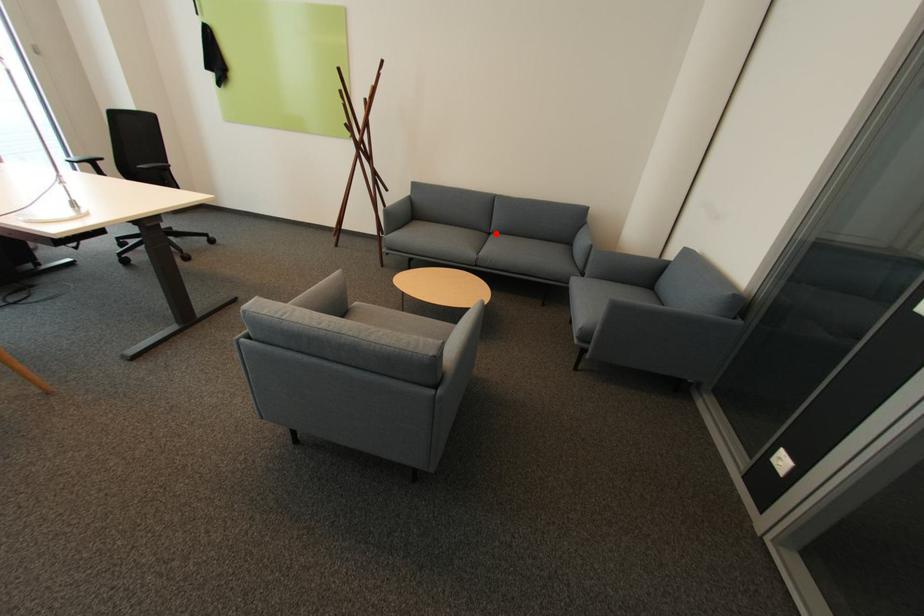
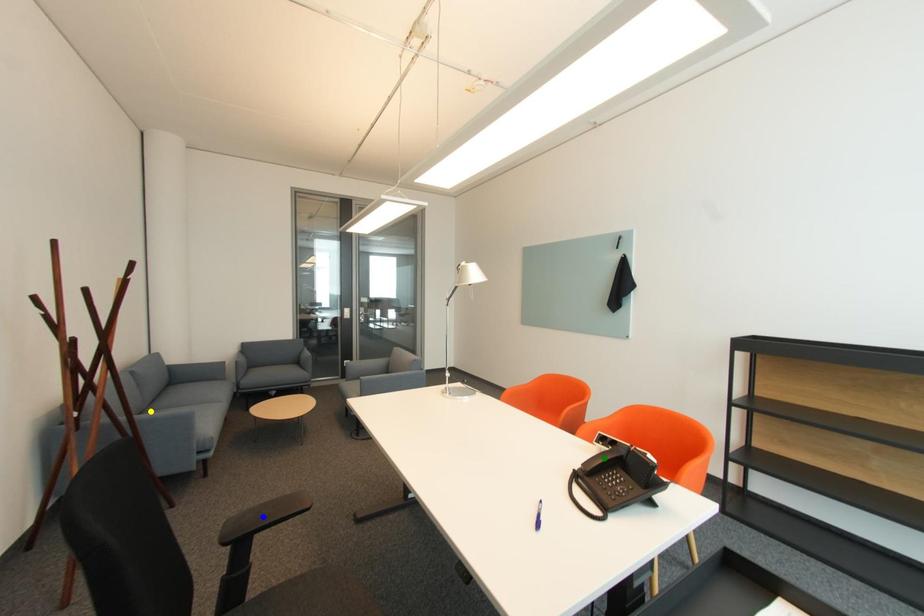
Question: I am providing you with two images of the same scene from different viewpoints. A red point is marked on the first image. You are given multiple points on the second image. In image 2, which mark is for the same physical point as the one in image 1?

Choices:
 (A) green point
 (B) yellow point
 (C) blue point

Answer: (B)